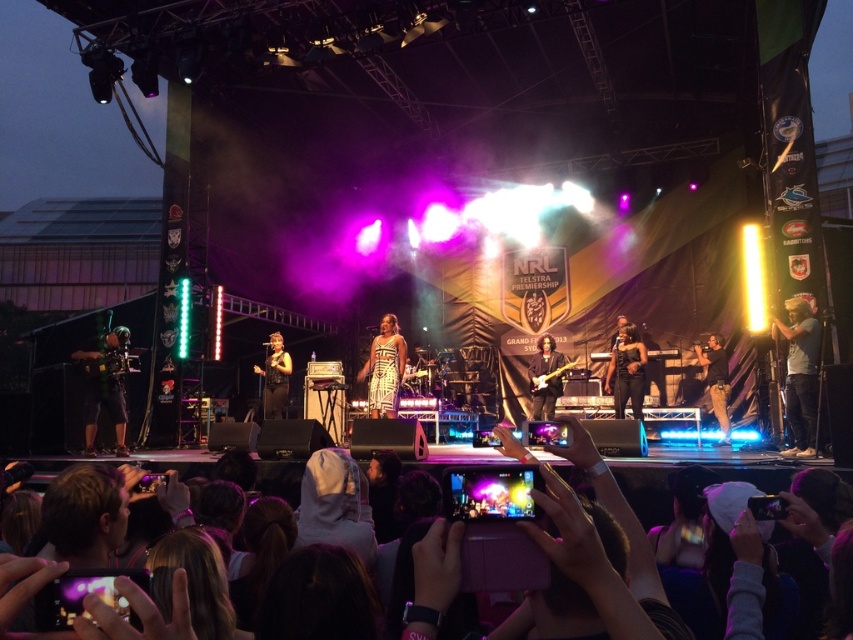
You are attending the NRL Telstra Premiership Grand Final 2013 concert and want to take a photo of the stage. You notice two points on the stage at coordinates point (390, 372) and point (714, 369). If you want to focus on the point closer to you, which coordinate should you aim your camera at?

You should aim your camera at point (390, 372) because it is closer to the viewer than point (714, 369).

You are a photographer at the concert and want to capture both the white cotton shirt at right and the matte black microphone at center in a single frame. Which object should you zoom in on to ensure both are clearly visible?

The white cotton shirt at right has a lesser width compared to matte black microphone at center, so you should zoom in on the matte black microphone at center to ensure both objects are clearly visible in the frame.

You are a photographer positioned at the center of the stage during the NRL Telstra Premiership Grand Final 2013 concert. You want to capture both the point at coordinates point (799, 323) and point (268, 401) in your shot. Which point should you focus on first to ensure both are in frame?

You should focus on point (268, 401) first because point (799, 323) is in front of it, so adjusting the focus starting from the farther point ensures both are within the camera frame.